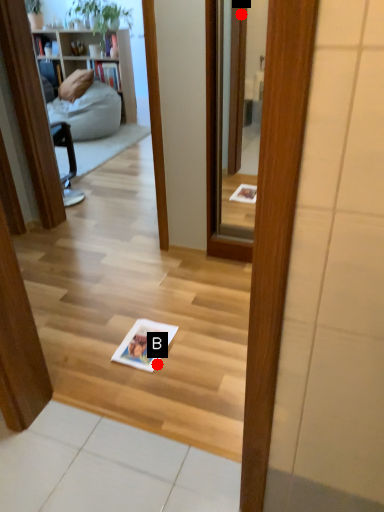
Question: Two points are circled on the image, labeled by A and B beside each circle. Which of the following is the closest to the observer?

Choices:
 (A) A is closer
 (B) B is closer

Answer: (B)